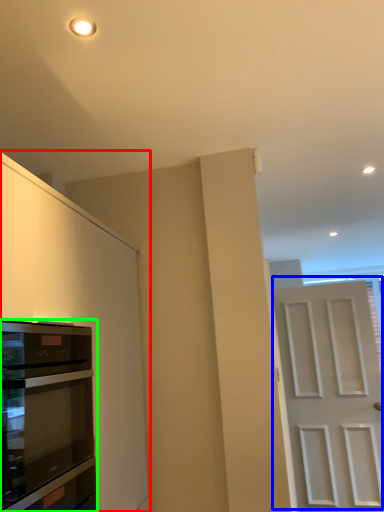
Question: Which object is positioned farthest from cabinetry (highlighted by a red box)? Select from door (highlighted by a blue box) and oven (highlighted by a green box).

Choices:
 (A) door
 (B) oven

Answer: (A)